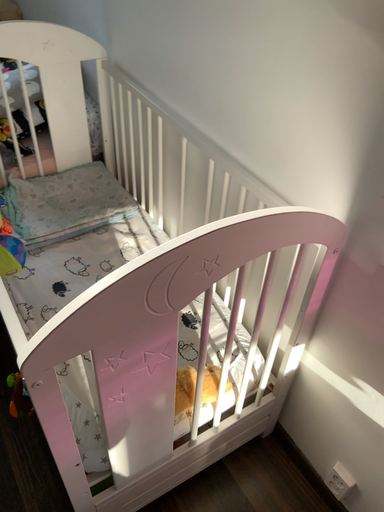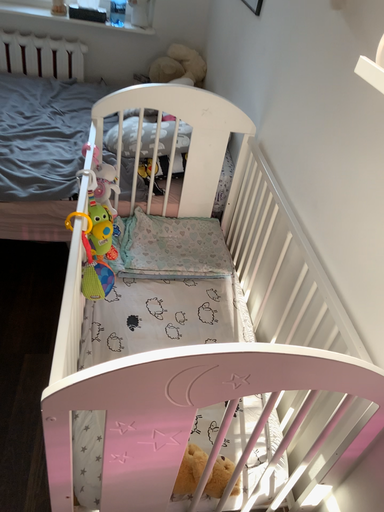
Question: Which way did the camera rotate in the video?

Choices:
 (A) rotated upward
 (B) rotated downward

Answer: (A)